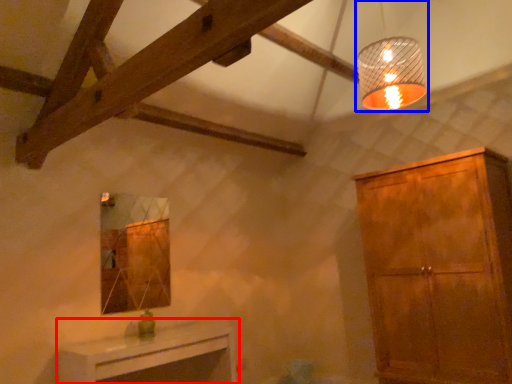
Question: Which point is closer to the camera, table (highlighted by a red box) or lamp (highlighted by a blue box)?

Choices:
 (A) table
 (B) lamp

Answer: (B)